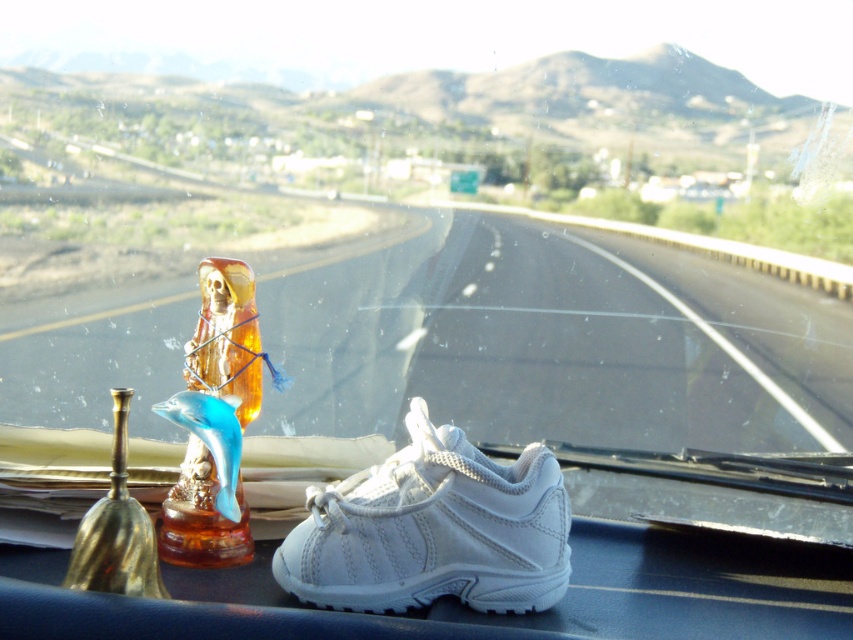
Between white leather shoe at center and translucent amber glass figurine at center, which one appears on the right side from the viewer's perspective?

From the viewer's perspective, white leather shoe at center appears more on the right side.

Can you confirm if white leather shoe at center is positioned above translucent amber glass figurine at center?

Actually, white leather shoe at center is below translucent amber glass figurine at center.

You are a GUI agent. You are given a task and a screenshot of the screen. Output one action in this format:
    pyautogui.click(x=<x>, y=<y>)
    Task: Click on the white leather shoe at center
    The width and height of the screenshot is (853, 640).
    Given the screenshot: What is the action you would take?
    click(x=433, y=529)

This screenshot has height=640, width=853. What are the coordinates of `white leather shoe at center` in the screenshot? It's located at (433, 529).